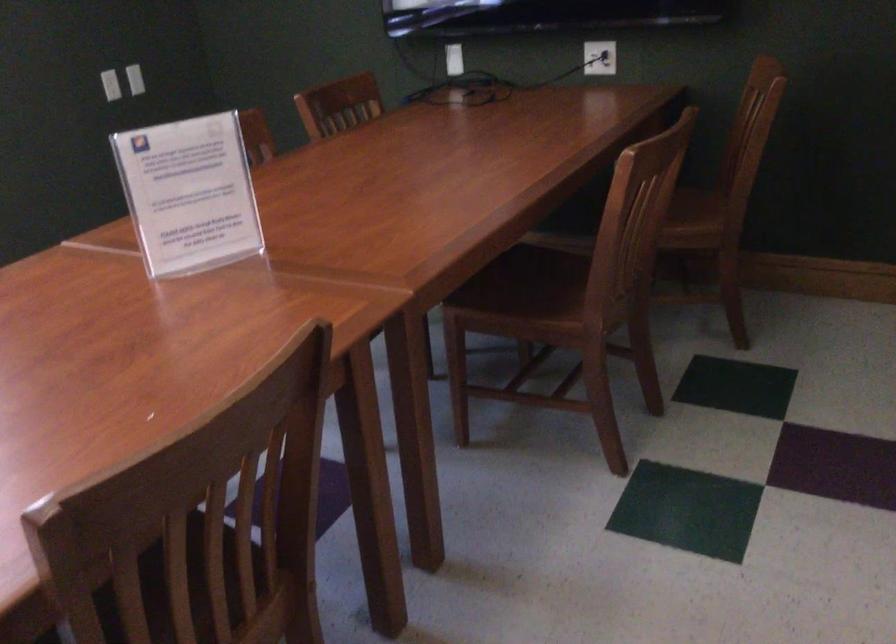
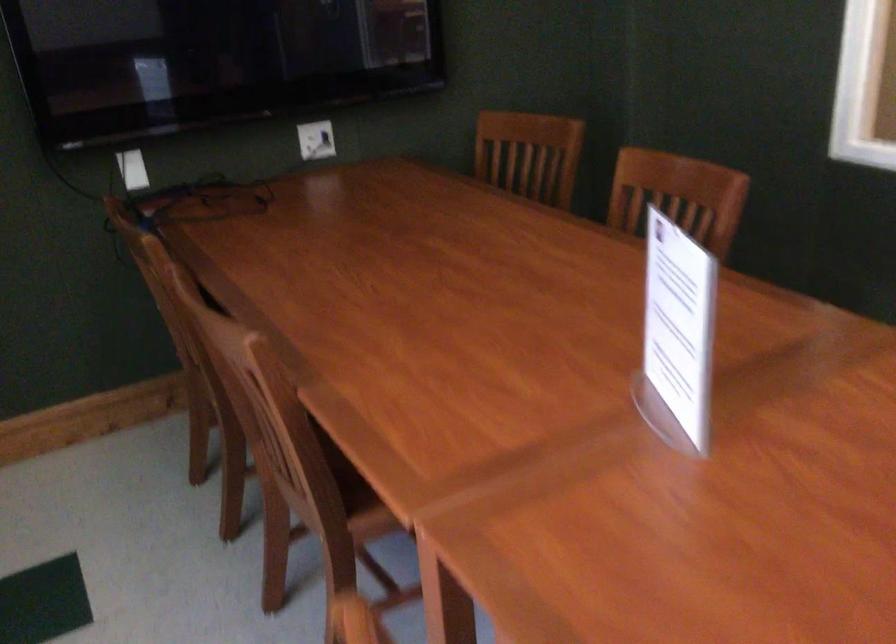
In the second image, find the point that corresponds to point (186, 205) in the first image.

(677, 335)